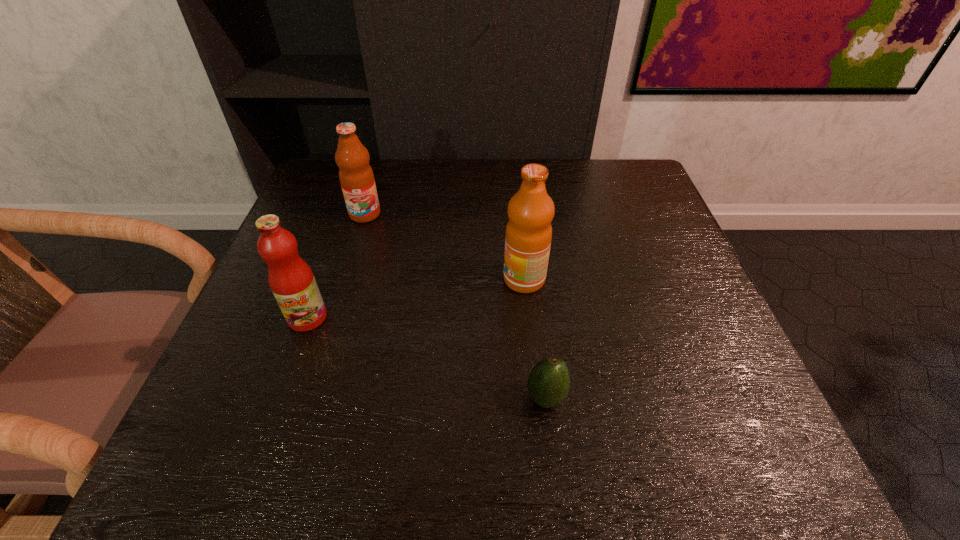
Find the location of a particular element. The height and width of the screenshot is (540, 960). vacant space that satisfies the following two spatial constraints: 1. on the front label of the nearest fruit juice; 2. on the left side of the avocado is located at coordinates (278, 397).